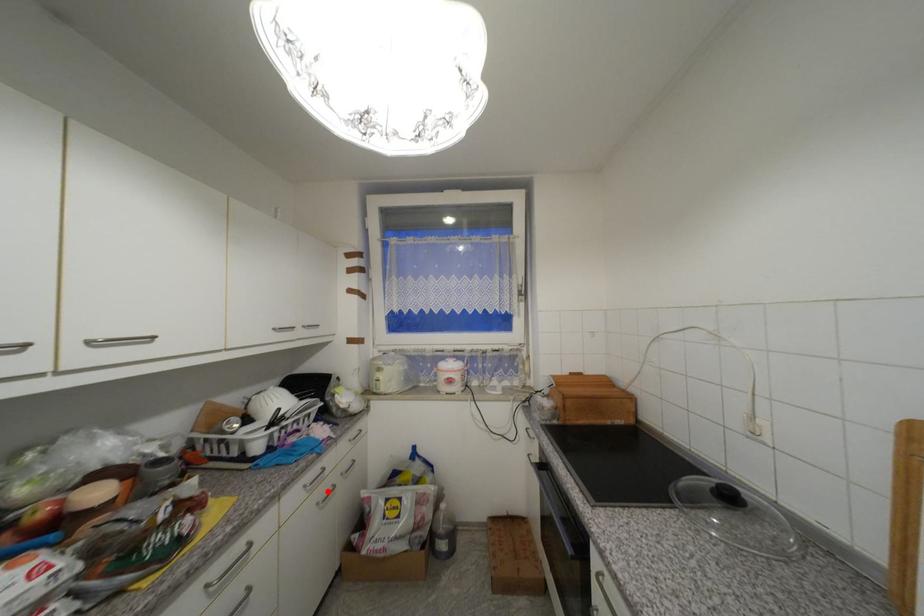
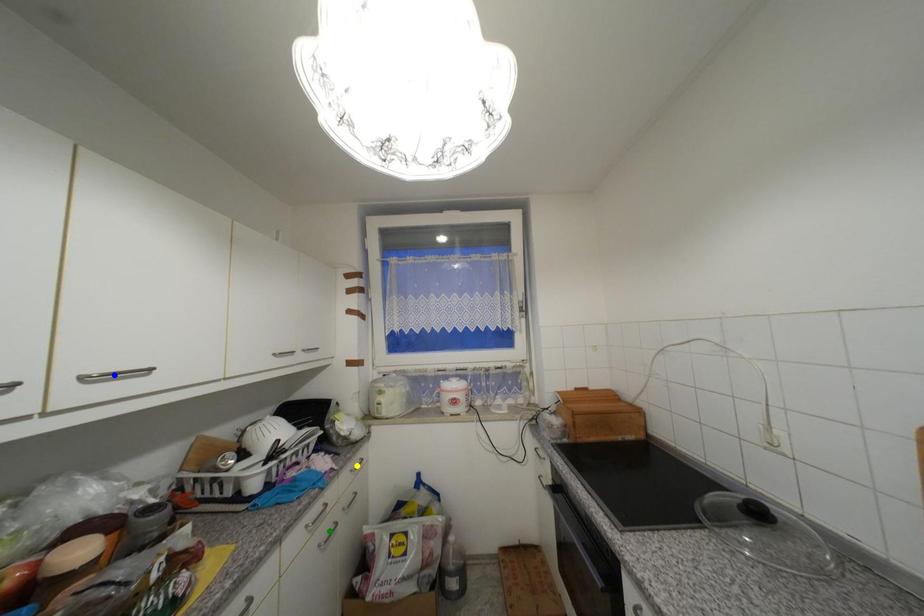
Question: I am providing you with two images of the same scene from different viewpoints. A red point is marked on the first image. You are given multiple points on the second image. Which point in image 2 is actually the same real-world point as the red point in image 1?

Choices:
 (A) green point
 (B) blue point
 (C) yellow point

Answer: (A)